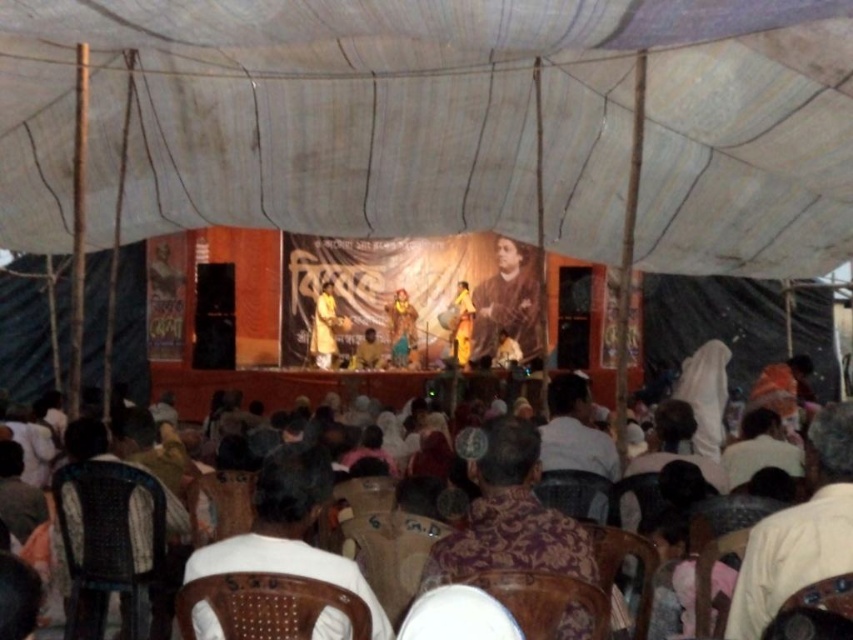
Question: Which point is farther to the camera?

Choices:
 (A) golden fabric dress at center
 (B) yellow fabric at center
 (C) brown fabric cloth at center

Answer: (A)

Question: Is golden fabric sari at center wider than brown fabric cloth at center?

Choices:
 (A) no
 (B) yes

Answer: (B)

Question: Does white fabric chairs at center appear under golden fabric sari at center?

Choices:
 (A) no
 (B) yes

Answer: (B)

Question: Which point is farther from the camera taking this photo?

Choices:
 (A) (300, 564)
 (B) (392, 346)
 (C) (485, 337)

Answer: (C)

Question: Considering the relative positions of golden fabric sari at center and brown fabric cloth at center in the image provided, where is golden fabric sari at center located with respect to brown fabric cloth at center?

Choices:
 (A) left
 (B) right

Answer: (A)

Question: Which point appears closest to the camera in this image?

Choices:
 (A) (397, 308)
 (B) (218, 563)
 (C) (724, 358)
 (D) (320, 336)

Answer: (B)